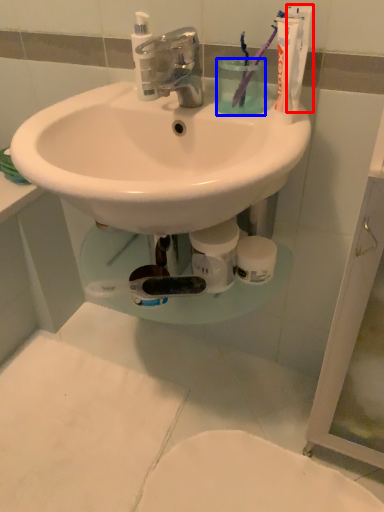
Question: Which object appears closest to the camera in this image, toothpaste (highlighted by a red box) or liquid (highlighted by a blue box)?

Choices:
 (A) toothpaste
 (B) liquid

Answer: (A)